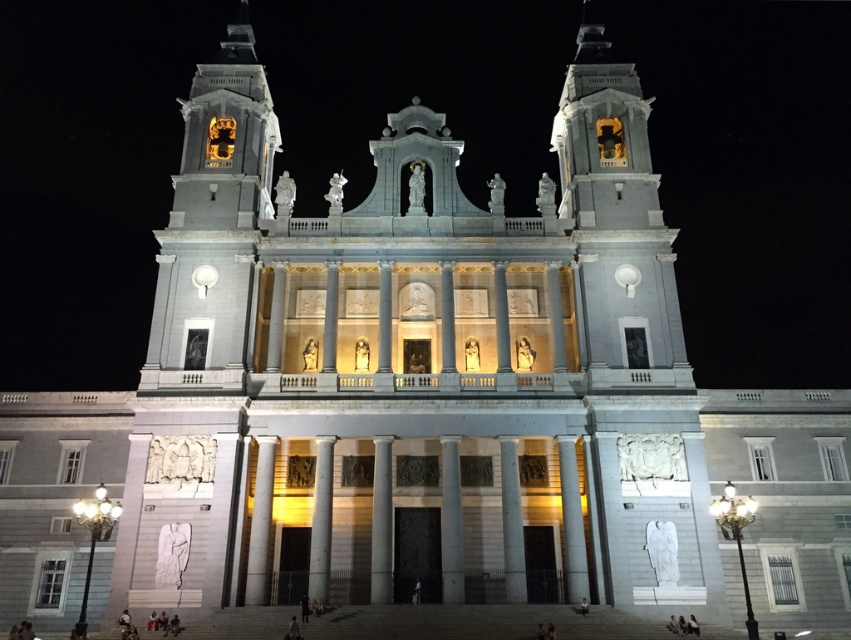
Question: Among these objects, which one is nearest to the camera?

Choices:
 (A) white marble column at center
 (B) smooth stone tower at center-left

Answer: (A)

Question: Where is smooth stone tower at center-left located in relation to white marble column at center in the image?

Choices:
 (A) above
 (B) below

Answer: (A)

Question: Is smooth stone tower at center-left above white marble column at center?

Choices:
 (A) no
 (B) yes

Answer: (B)

Question: Does smooth stone tower at center-left come behind white marble column at center?

Choices:
 (A) yes
 (B) no

Answer: (A)

Question: Which object is closer to the camera taking this photo?

Choices:
 (A) white marble column at center
 (B) smooth stone tower at center-left

Answer: (A)